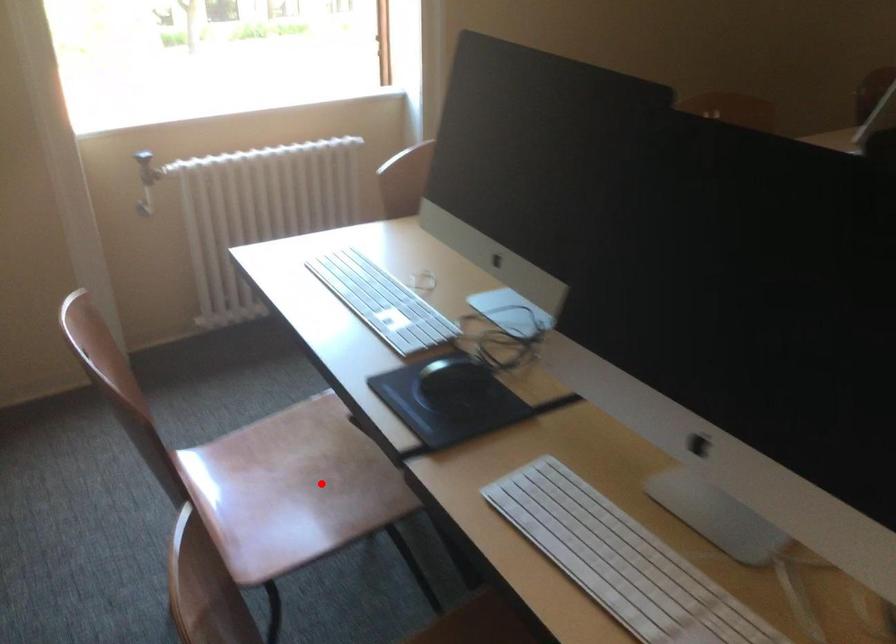
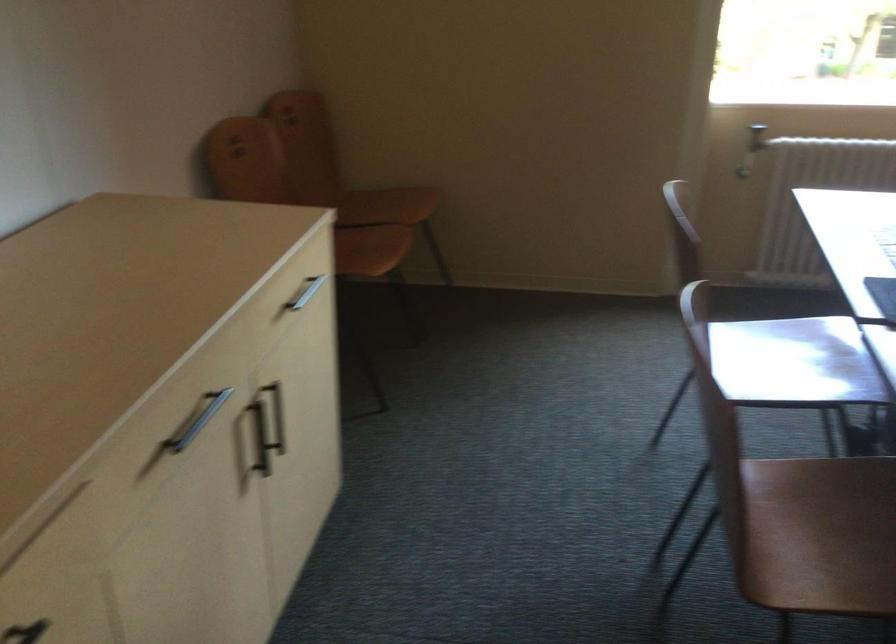
Question: I am providing you with two images of the same scene from different viewpoints. A red point is shown in image1. For the corresponding object point in image2, is it positioned nearer or farther from the camera?

Choices:
 (A) Nearer
 (B) Farther

Answer: (B)